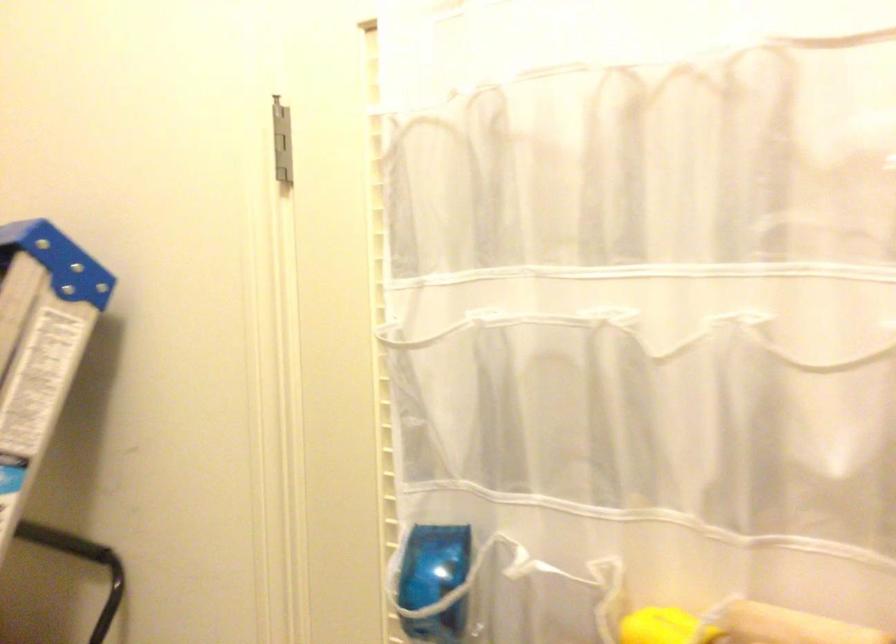
You are a GUI agent. You are given a task and a screenshot of the screen. Output one action in this format:
    pyautogui.click(x=<x>, y=<y>)
    Task: Click on the beige roller
    The height and width of the screenshot is (644, 896).
    Given the screenshot: What is the action you would take?
    pyautogui.click(x=742, y=626)